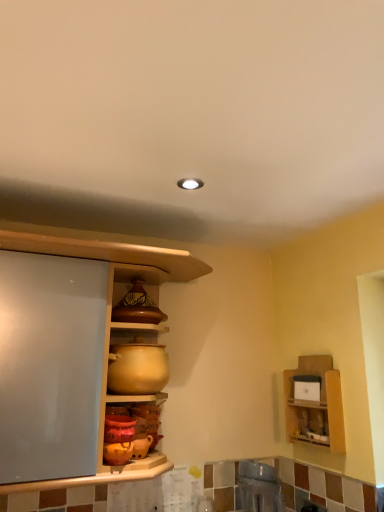
Question: From a real-world perspective, is matte wood cabinet at center physically above metallic stainless steel sink at lower center, the second appliance viewed from the top?

Choices:
 (A) no
 (B) yes

Answer: (B)

Question: Is metallic stainless steel sink at lower center, the second appliance viewed from the top, inside matte wood cabinet at center?

Choices:
 (A) no
 (B) yes

Answer: (A)

Question: Would you say matte wood cabinet at center is outside metallic stainless steel sink at lower center, the second appliance viewed from the top?

Choices:
 (A) no
 (B) yes

Answer: (B)

Question: Is matte wood cabinet at center placed right next to metallic stainless steel sink at lower center, the second appliance viewed from the top?

Choices:
 (A) yes
 (B) no

Answer: (B)

Question: Is matte wood cabinet at center taller than metallic stainless steel sink at lower center, which is the second appliance in left-to-right order?

Choices:
 (A) yes
 (B) no

Answer: (A)

Question: Is matte wood cabinet at center looking in the opposite direction of metallic stainless steel sink at lower center, which is the second appliance in left-to-right order?

Choices:
 (A) no
 (B) yes

Answer: (A)

Question: Considering the relative sizes of matte brown ceramic pot at upper center and matte ceramic pot at center, placed as the 1th appliance when sorted from left to right, in the image provided, is matte brown ceramic pot at upper center wider than matte ceramic pot at center, placed as the 1th appliance when sorted from left to right,?

Choices:
 (A) yes
 (B) no

Answer: (B)

Question: From the image's perspective, is matte brown ceramic pot at upper center located beneath matte ceramic pot at center, which appears as the second appliance when viewed from the right?

Choices:
 (A) yes
 (B) no

Answer: (B)

Question: Is matte brown ceramic pot at upper center at the left side of matte ceramic pot at center, which appears as the second appliance when viewed from the right?

Choices:
 (A) no
 (B) yes

Answer: (A)

Question: Can you confirm if matte brown ceramic pot at upper center is taller than matte ceramic pot at center, the second appliance ordered from the bottom?

Choices:
 (A) yes
 (B) no

Answer: (B)

Question: Can you confirm if matte brown ceramic pot at upper center is bigger than matte ceramic pot at center, which is the first appliance from top to bottom?

Choices:
 (A) no
 (B) yes

Answer: (A)

Question: Considering the relative sizes of matte brown ceramic pot at upper center and matte ceramic pot at center, the second appliance ordered from the bottom, in the image provided, is matte brown ceramic pot at upper center thinner than matte ceramic pot at center, the second appliance ordered from the bottom,?

Choices:
 (A) no
 (B) yes

Answer: (B)

Question: Is metallic stainless steel sink at lower center, which appears as the first appliance when ordered from the bottom, facing away from wooden shelf at upper right?

Choices:
 (A) no
 (B) yes

Answer: (A)